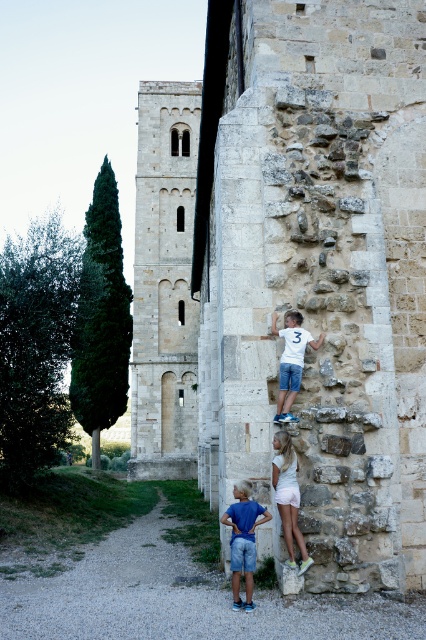
Is stone textured wall at right closer to the viewer compared to white cotton shorts at center?

No, it is behind white cotton shorts at center.

Who is more distant from viewer, (365, 144) or (298, 545)?

The point (365, 144) is more distant.

At what (x,y) coordinates should I click in order to perform the action: click on stone textured wall at right. Please return your answer as a coordinate pair (x, y). The width and height of the screenshot is (426, 640). Looking at the image, I should click on (317, 269).

Can you confirm if stone textured wall at right is bigger than blue denim shorts at lower center?

Yes.

The width and height of the screenshot is (426, 640). Describe the element at coordinates (317, 269) in the screenshot. I see `stone textured wall at right` at that location.

Find the location of a particular element. The image size is (426, 640). stone textured wall at right is located at coordinates (317, 269).

Which is more to the right, stone textured tower at center or blue denim shorts at lower center?

blue denim shorts at lower center is more to the right.

Is stone textured tower at center shorter than blue denim shorts at lower center?

No, stone textured tower at center is not shorter than blue denim shorts at lower center.

Is point (184, 221) positioned behind point (236, 566)?

Yes, it is behind point (236, 566).

You are a GUI agent. You are given a task and a screenshot of the screen. Output one action in this format:
    pyautogui.click(x=<x>, y=<y>)
    Task: Click on the stone textured tower at center
    
    Given the screenshot: What is the action you would take?
    pyautogui.click(x=164, y=284)